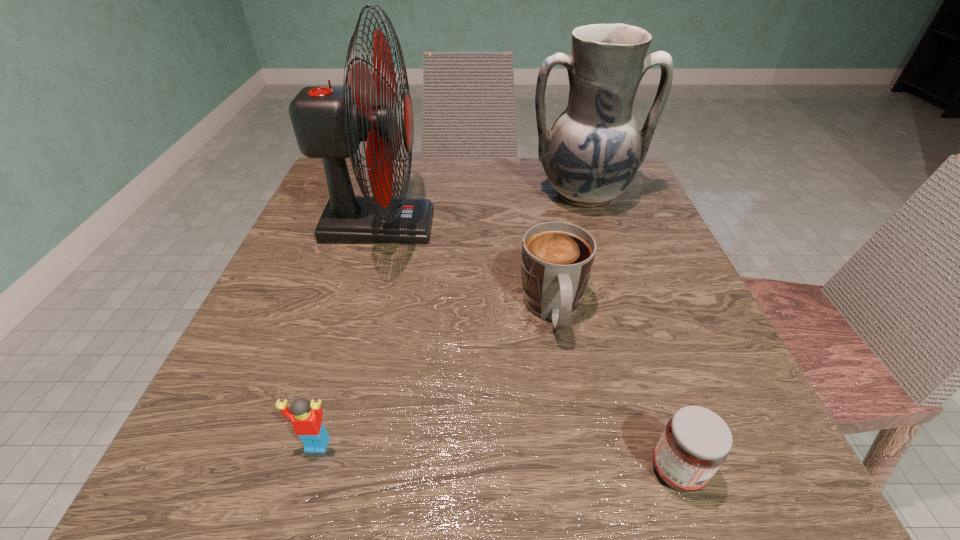
Locate an element on the screen. free region that satisfies the following two spatial constraints: 1. on the front-facing side of the jam; 2. on the right side of the tallest object is located at coordinates (307, 470).

Identify the location of vacant area that satisfies the following two spatial constraints: 1. on the front-facing side of the tallest object; 2. on the back side of the jam. (307, 470).

You are a GUI agent. You are given a task and a screenshot of the screen. Output one action in this format:
    pyautogui.click(x=<x>, y=<y>)
    Task: Click on the vacant area that satisfies the following two spatial constraints: 1. on the front-facing side of the jam; 2. on the right side of the fan
    
    Given the screenshot: What is the action you would take?
    pyautogui.click(x=307, y=470)